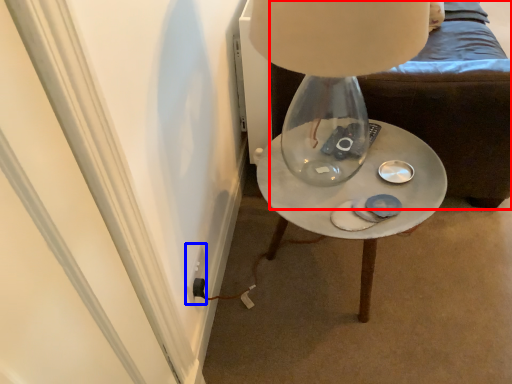
Question: Among these objects, which one is nearest to the camera, furniture (highlighted by a red box) or electric outlet (highlighted by a blue box)?

Choices:
 (A) furniture
 (B) electric outlet

Answer: (A)